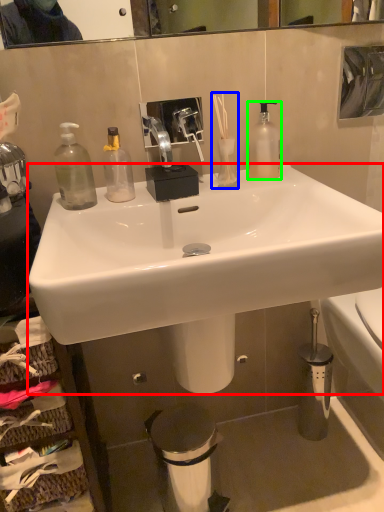
Question: Estimate the real-world distances between objects in this image. Which object is farther from sink (highlighted by a red box), toiletry (highlighted by a blue box) or bottle (highlighted by a green box)?

Choices:
 (A) toiletry
 (B) bottle

Answer: (B)